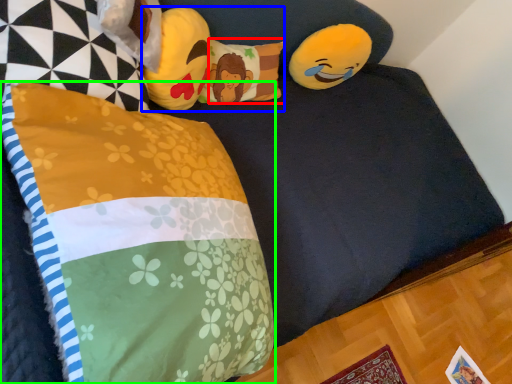
Question: Considering the real-world distances, which object is farthest from pillow (highlighted by a red box)? toy (highlighted by a blue box) or pillow (highlighted by a green box)?

Choices:
 (A) toy
 (B) pillow

Answer: (B)